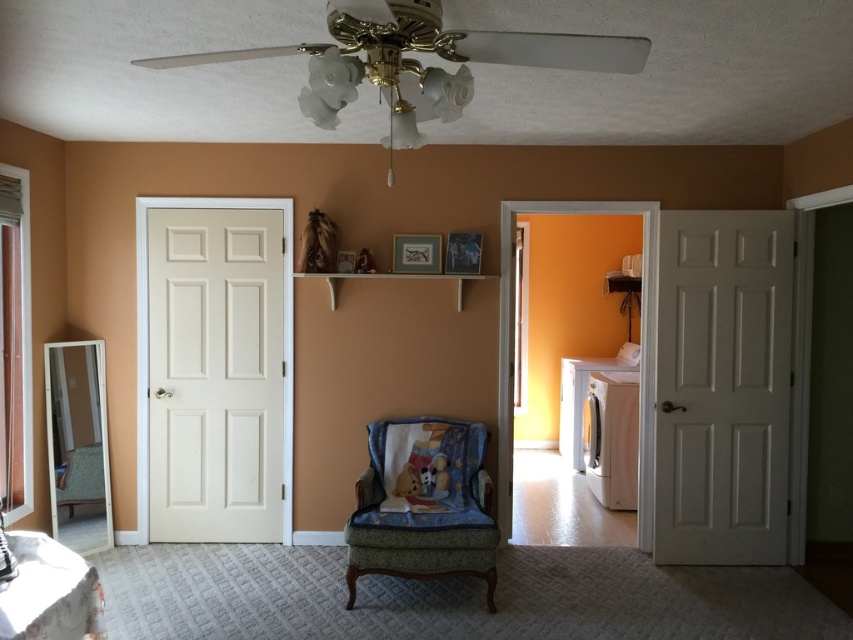
You are planning to hang a new painting between the white plastic fan at upper center and the velvet green armchair at center. Which object should the painting be placed closer to if you want it centered between them?

The painting should be placed closer to the white plastic fan at upper center because it is positioned on the left side of the velvet green armchair at center, so the center point between them would be closer to the fan.

You are standing in the room and want to locate the point at coordinates (416, 60). According to the scene description, where exactly is this point located?

The point at coordinates (416, 60) is on the white plastic fan at upper center.